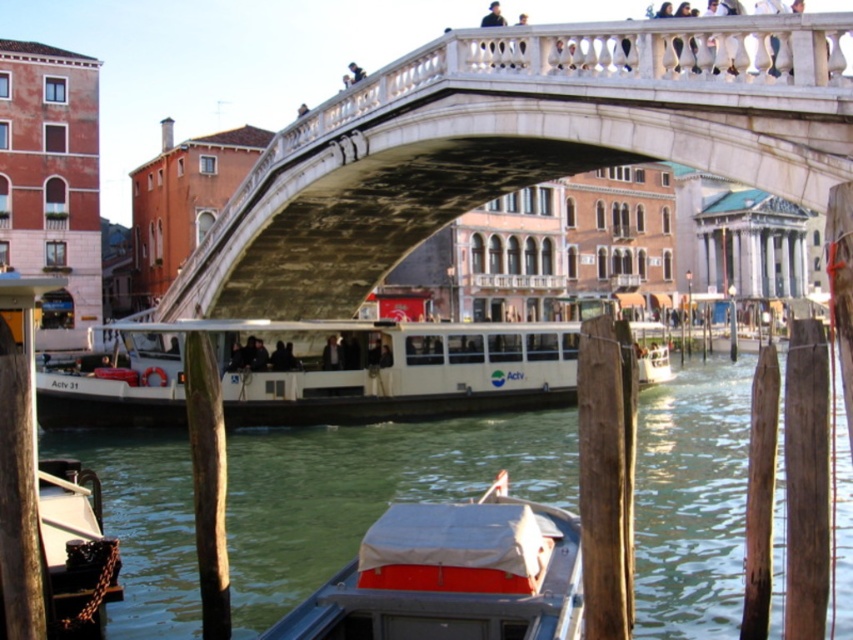
You are a tourist standing on the wooden pier where the white matte boat at center is docked. You want to take a photo of the white marble bridge at center. Which direction should you face to ensure the bridge is fully visible in your shot?

You should face towards the background where the white marble bridge at center is located, as it is positioned above the white matte boat at center, ensuring the bridge will be fully visible in your photo.

You are a tourist standing on the wooden pier and want to take a photo of the white marble bridge at center and the white matte boat at center. Which object should you focus on first if you want to capture both in a single frame without moving the camera?

The white marble bridge at center is positioned on the left side of the white matte boat at center, so you should focus on the white marble bridge at center first to ensure both objects are within the camera frame.

You are standing on the wooden pier in Venice and want to take a photo of the historic bridge. There are two points marked on your camera screen at coordinates point (561, 99) and point (564, 556). Which point is closer to you when you take the photo?

Point (564, 556) is closer to you because the description states that point (561, 99) is further to the camera than point (564, 556).